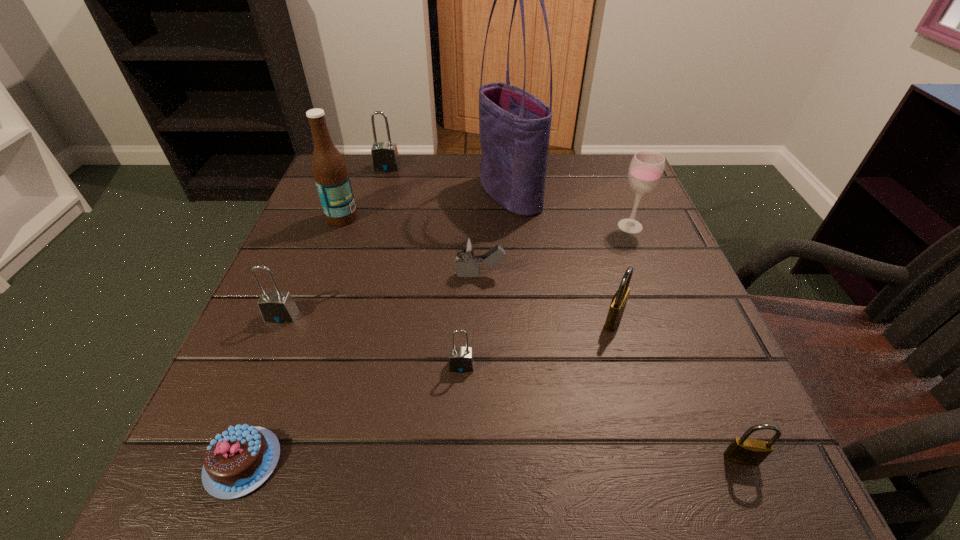
At what (x,y) coordinates should I click in order to perform the action: click on vacant space at the left edge. Please return your answer as a coordinate pair (x, y). Looking at the image, I should click on (353, 296).

Identify the location of vacant space at the right edge of the desktop. (622, 212).

Locate an element on the screen. Image resolution: width=960 pixels, height=540 pixels. vacant space at the far left corner of the desktop is located at coordinates (362, 194).

In the image, there is a desktop. At what (x,y) coordinates should I click in order to perform the action: click on vacant space at the near left corner. Please return your answer as a coordinate pair (x, y). Looking at the image, I should click on (278, 438).

The height and width of the screenshot is (540, 960). In order to click on unoccupied position between the second padlock from right to left and the smallest gray padlock in this screenshot , I will do `click(538, 343)`.

Locate an element on the screen. This screenshot has width=960, height=540. unoccupied area between the wineglass and the tallest object is located at coordinates (570, 210).

Image resolution: width=960 pixels, height=540 pixels. What are the coordinates of `vacant area that lies between the second biggest gray padlock and the ninth shortest object` in the screenshot? It's located at (312, 267).

The height and width of the screenshot is (540, 960). What are the coordinates of `empty space that is in between the rightmost gray padlock and the farthest padlock` in the screenshot? It's located at (424, 267).

Locate an element on the screen. vacant region between the farther brass padlock and the farthest padlock is located at coordinates (500, 244).

Find the location of a particular element. This screenshot has width=960, height=540. vacant space that's between the rightmost gray padlock and the igniter is located at coordinates pyautogui.click(x=471, y=321).